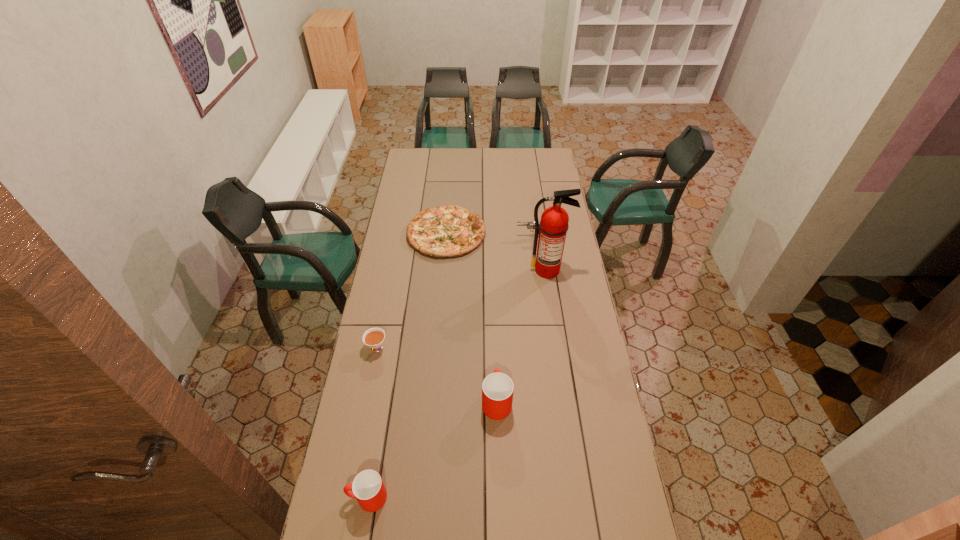
Where is `object that stands as the third closest to the tallest object`? object that stands as the third closest to the tallest object is located at coordinates (497, 388).

Image resolution: width=960 pixels, height=540 pixels. I want to click on free point that satisfies the following two spatial constraints: 1. on the side of the shorter cup with the handle; 2. on the side of the second nearest object with the handle, so click(384, 401).

At what (x,y) coordinates should I click in order to perform the action: click on free location that satisfies the following two spatial constraints: 1. on the side of the shorter cup with the handle; 2. on the side of the third nearest object with the handle. Please return your answer as a coordinate pair (x, y). This screenshot has width=960, height=540. Looking at the image, I should click on (392, 349).